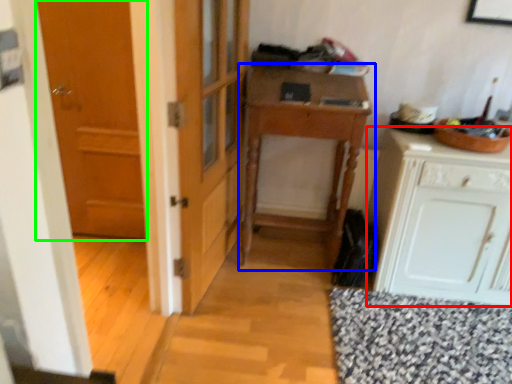
Question: Which object is positioned farthest from cabinetry (highlighted by a red box)? Select from table (highlighted by a blue box) and door (highlighted by a green box).

Choices:
 (A) table
 (B) door

Answer: (B)